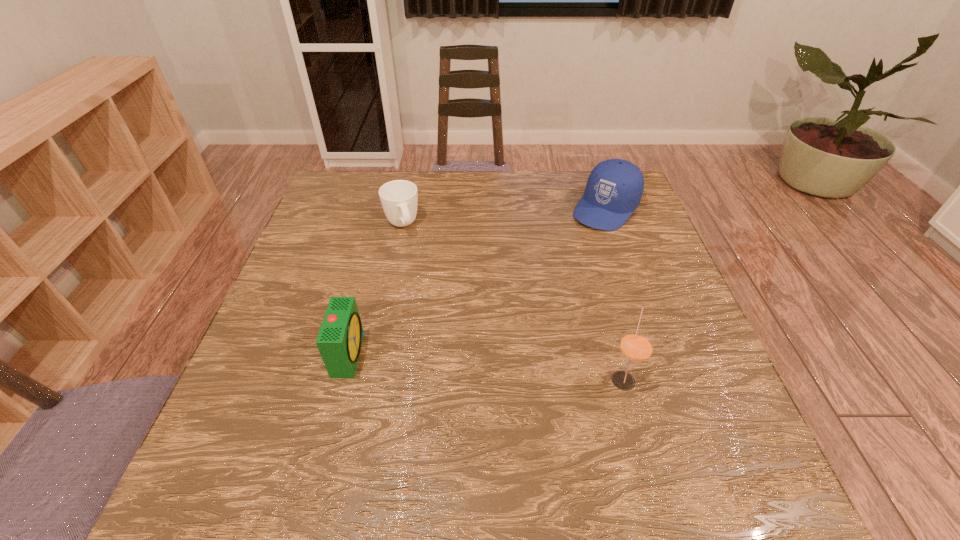
The height and width of the screenshot is (540, 960). In order to click on vacant area between the tallest object and the alarm clock in this screenshot , I will do `click(486, 366)`.

Locate an element on the screen. The image size is (960, 540). free area in between the cap and the alarm clock is located at coordinates pos(477,281).

At what (x,y) coordinates should I click in order to perform the action: click on object that stands as the third closest to the cup. Please return your answer as a coordinate pair (x, y). The width and height of the screenshot is (960, 540). Looking at the image, I should click on (636, 346).

Identify the location of object that stands as the second closest to the cap. The image size is (960, 540). (399, 198).